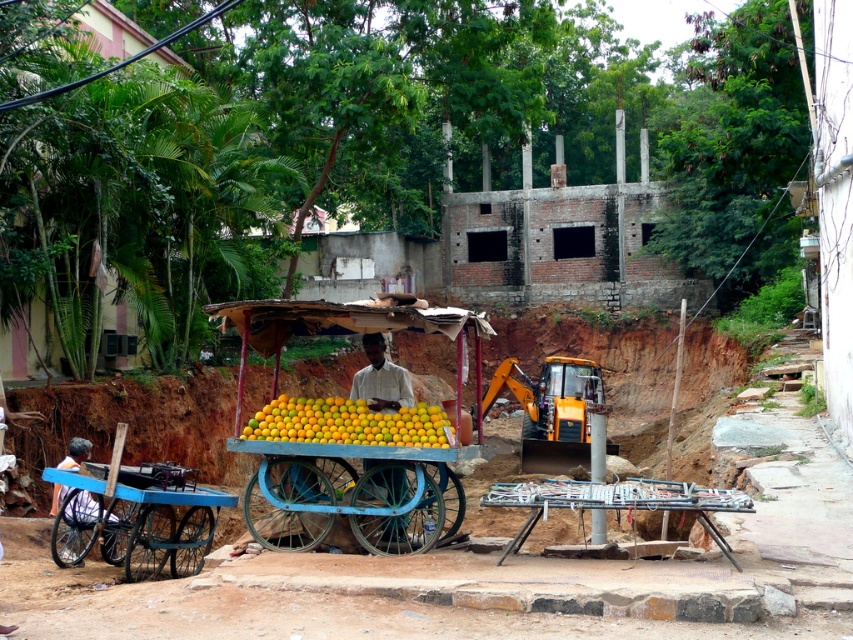
You are a customer at the fruit stall and want to reach the vendor standing behind the cart. There are yellow matte oranges at center and a white matte man at center in your way. Which object do you need to move to get to the vendor?

The white matte man at center is in your way, so you need to move the white matte man at center to get to the vendor.

You are a delivery person with a cart that is 2 meters wide. You need to move from the blue painted wood cart at lower left to the metallic silver grill at lower center. Is there enough space between them for your cart to pass through?

The distance between the blue painted wood cart at lower left and the metallic silver grill at lower center is 5.52 meters. Since your cart is only 2 meters wide, there is sufficient space for it to pass through the 5.52 meter gap between them.